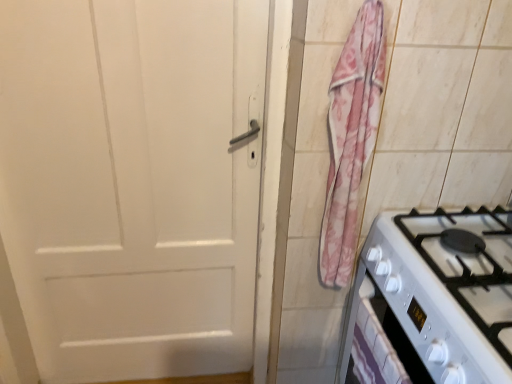
Question: Is pink floral fabric at right wider than white glossy drawer at lower right?

Choices:
 (A) yes
 (B) no

Answer: (A)

Question: Is pink floral fabric at right further to camera compared to white glossy drawer at lower right?

Choices:
 (A) no
 (B) yes

Answer: (B)

Question: From a real-world perspective, is pink floral fabric at right physically below white glossy drawer at lower right?

Choices:
 (A) no
 (B) yes

Answer: (A)

Question: Does pink floral fabric at right have a larger size compared to white glossy drawer at lower right?

Choices:
 (A) no
 (B) yes

Answer: (B)

Question: From the image's perspective, is pink floral fabric at right beneath white glossy drawer at lower right?

Choices:
 (A) yes
 (B) no

Answer: (B)

Question: Based on their sizes in the image, would you say white glossy gas stove at lower right is bigger or smaller than white glossy drawer at lower right?

Choices:
 (A) big
 (B) small

Answer: (A)

Question: Considering their positions, is white glossy gas stove at lower right located in front of or behind white glossy drawer at lower right?

Choices:
 (A) front
 (B) behind

Answer: (A)

Question: From a real-world perspective, is white glossy gas stove at lower right positioned above or below white glossy drawer at lower right?

Choices:
 (A) below
 (B) above

Answer: (B)

Question: From the image's perspective, relative to white glossy drawer at lower right, is white glossy gas stove at lower right above or below?

Choices:
 (A) above
 (B) below

Answer: (A)

Question: Is white glossy drawer at lower right wider or thinner than pink floral fabric at right?

Choices:
 (A) thin
 (B) wide

Answer: (A)

Question: Based on their sizes in the image, would you say white glossy drawer at lower right is bigger or smaller than pink floral fabric at right?

Choices:
 (A) big
 (B) small

Answer: (B)

Question: In the image, is white glossy drawer at lower right positioned in front of or behind pink floral fabric at right?

Choices:
 (A) front
 (B) behind

Answer: (A)

Question: Choose the correct answer: Is white glossy drawer at lower right inside pink floral fabric at right or outside it?

Choices:
 (A) outside
 (B) inside

Answer: (A)

Question: From a real-world perspective, is white glossy gas stove at lower right physically located above or below pink floral fabric at right?

Choices:
 (A) below
 (B) above

Answer: (A)

Question: Do you think white glossy gas stove at lower right is within pink floral fabric at right, or outside of it?

Choices:
 (A) inside
 (B) outside

Answer: (B)